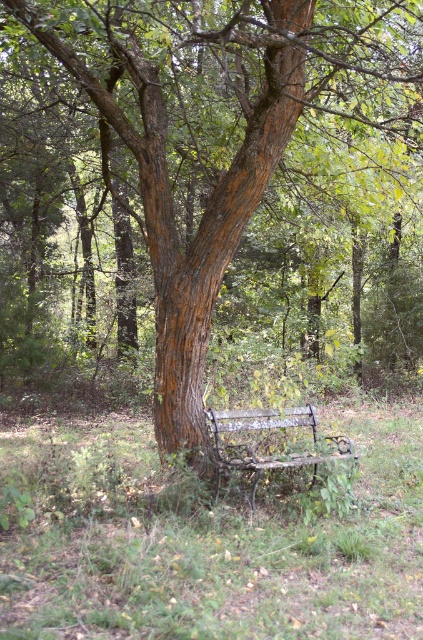
Which is in front, point (10, 445) or point (308, 417)?

Point (308, 417)

Does green grass at lower center lie in front of rusty metal bench at center?

Yes, green grass at lower center is in front of rusty metal bench at center.

Where is `green grass at lower center`? green grass at lower center is located at coordinates (209, 541).